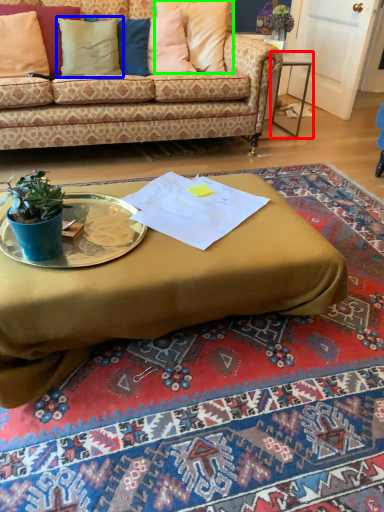
Question: Which is farther away from table (highlighted by a red box)? pillow (highlighted by a blue box) or pillow (highlighted by a green box)?

Choices:
 (A) pillow
 (B) pillow

Answer: (A)